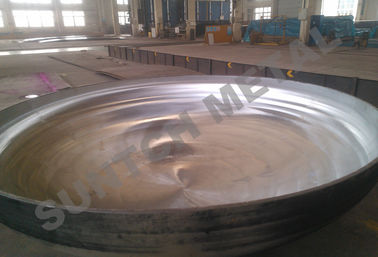
Where is `windows`? Image resolution: width=378 pixels, height=257 pixels. windows is located at coordinates (342, 4), (263, 13), (122, 16), (123, 1), (73, 19), (35, 15).